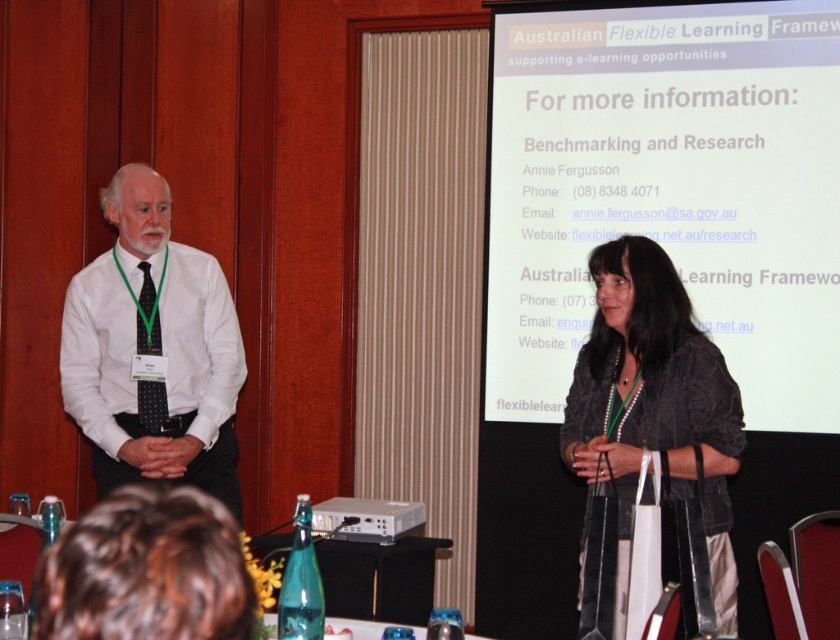
Question: From the image, what is the correct spatial relationship of white matte projection screen at upper center in relation to white shirt at center?

Choices:
 (A) below
 (B) above

Answer: (B)

Question: Estimate the real-world distances between objects in this image. Which object is closer to the brown hair at lower center?

Choices:
 (A) white matte projection screen at upper center
 (B) white shirt at center

Answer: (B)

Question: Does white plastic projector at lower center have a lesser width compared to black dotted tie at left?

Choices:
 (A) yes
 (B) no

Answer: (B)

Question: Is white shirt at center closer to camera compared to brown hair at lower center?

Choices:
 (A) no
 (B) yes

Answer: (A)

Question: Estimate the real-world distances between objects in this image. Which object is farther from the white shirt at center?

Choices:
 (A) brown hair at lower center
 (B) dark gray textured jacket at center
 (C) white plastic projector at lower center
 (D) white matte projection screen at upper center

Answer: (A)

Question: Which of these objects is positioned closest to the white shirt at center?

Choices:
 (A) white plastic projector at lower center
 (B) white matte projection screen at upper center
 (C) dark gray textured jacket at center

Answer: (A)